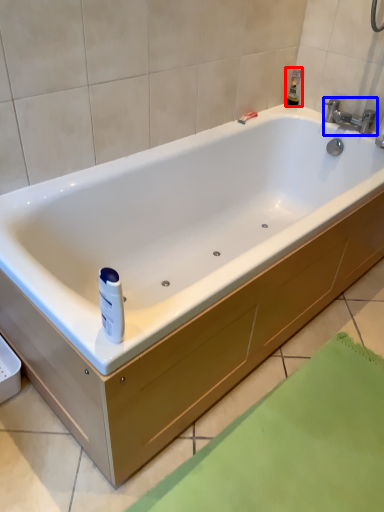
Question: Which point is closer to the camera, toiletry (highlighted by a red box) or tap (highlighted by a blue box)?

Choices:
 (A) toiletry
 (B) tap

Answer: (B)